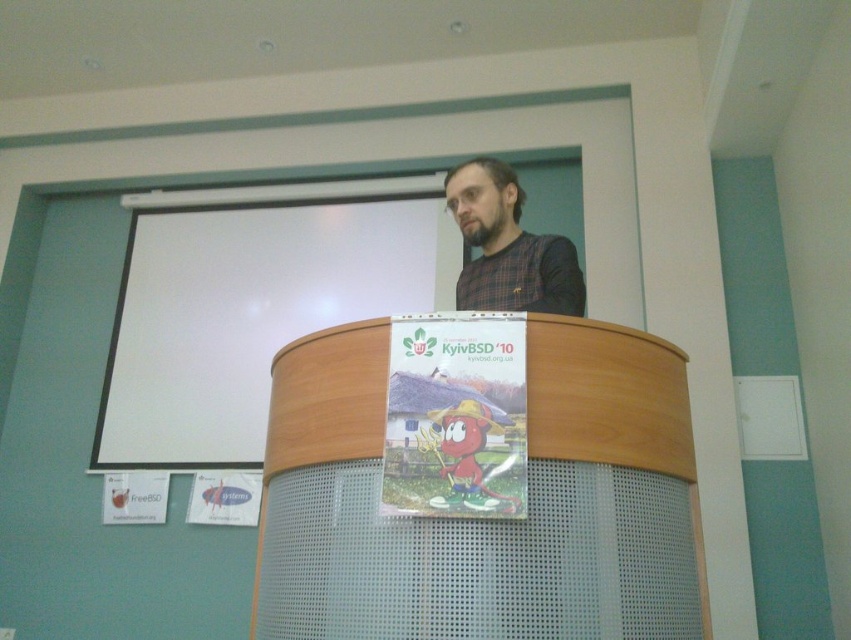
Question: Which object is positioned closest to the wooden podium at center?

Choices:
 (A) plaid fabric shirt at center
 (B) white matte projection screen at upper center

Answer: (A)

Question: Is wooden podium at center to the right of white matte projection screen at upper center from the viewer's perspective?

Choices:
 (A) yes
 (B) no

Answer: (A)

Question: Which point is farther to the camera?

Choices:
 (A) (495, 264)
 (B) (403, 228)
 (C) (561, 499)

Answer: (B)

Question: Among these objects, which one is farthest from the camera?

Choices:
 (A) white matte projection screen at upper center
 (B) wooden podium at center

Answer: (A)

Question: Is white matte projection screen at upper center to the left of plaid fabric shirt at center from the viewer's perspective?

Choices:
 (A) yes
 (B) no

Answer: (A)

Question: Considering the relative positions of wooden podium at center and plaid fabric shirt at center in the image provided, where is wooden podium at center located with respect to plaid fabric shirt at center?

Choices:
 (A) above
 (B) below

Answer: (B)